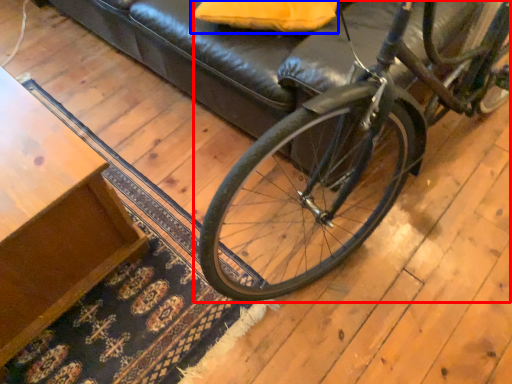
Question: Which object is further to the camera taking this photo, bicycle (highlighted by a red box) or pillow (highlighted by a blue box)?

Choices:
 (A) bicycle
 (B) pillow

Answer: (B)